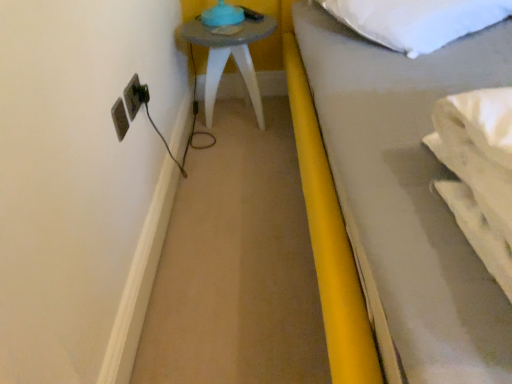
Question: Is point (453, 8) positioned closer to the camera than point (208, 69)?

Choices:
 (A) farther
 (B) closer

Answer: (B)

Question: Is white soft pillow at upper right situated inside matte gray side table at upper left or outside?

Choices:
 (A) outside
 (B) inside

Answer: (A)

Question: Estimate the real-world distances between objects in this image. Which object is closer to the matte gray side table at upper left?

Choices:
 (A) white soft pillow at upper right
 (B) matte plastic electrical outlet at left

Answer: (A)

Question: Which of these objects is positioned farthest from the matte gray side table at upper left?

Choices:
 (A) white soft pillow at upper right
 (B) matte plastic electrical outlet at left

Answer: (B)